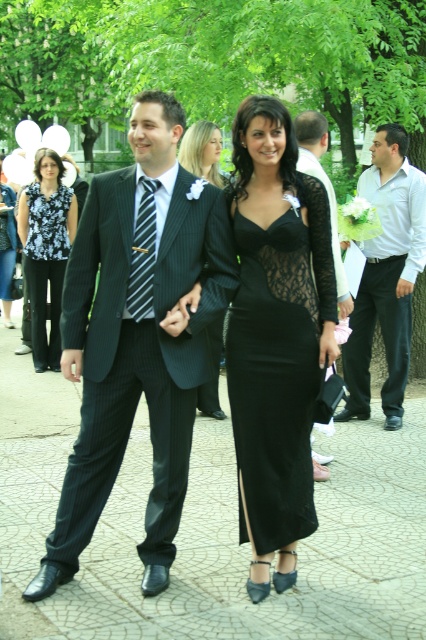
Is point (120, 205) closer to viewer compared to point (344, 294)?

That is True.

Does pinstriped suit at center have a lesser width compared to matte black suit at center?

No, pinstriped suit at center is not thinner than matte black suit at center.

Is point (192, 413) more distant than point (316, 125)?

No, (192, 413) is in front of (316, 125).

Image resolution: width=426 pixels, height=640 pixels. In order to click on pinstriped suit at center in this screenshot , I will do `click(137, 340)`.

In the scene shown: Is white shirt at center to the left of black lace dress at center from the viewer's perspective?

In fact, white shirt at center is to the right of black lace dress at center.

Can you confirm if white shirt at center is shorter than black lace dress at center?

No, white shirt at center is not shorter than black lace dress at center.

Is point (389, 173) positioned after point (215, 186)?

Yes, point (389, 173) is farther from viewer.

This screenshot has height=640, width=426. Find the location of `white shirt at center`. white shirt at center is located at coordinates (386, 275).

Does black lace dress at center have a lesser height compared to pinstriped fabric tie at center?

Indeed, black lace dress at center has a lesser height compared to pinstriped fabric tie at center.

Between black lace dress at center and pinstriped fabric tie at center, which one has more height?

With more height is pinstriped fabric tie at center.

Locate an element on the screen. The width and height of the screenshot is (426, 640). black lace dress at center is located at coordinates (201, 150).

Locate an element on the screen. Image resolution: width=426 pixels, height=640 pixels. black lace dress at center is located at coordinates (201, 150).